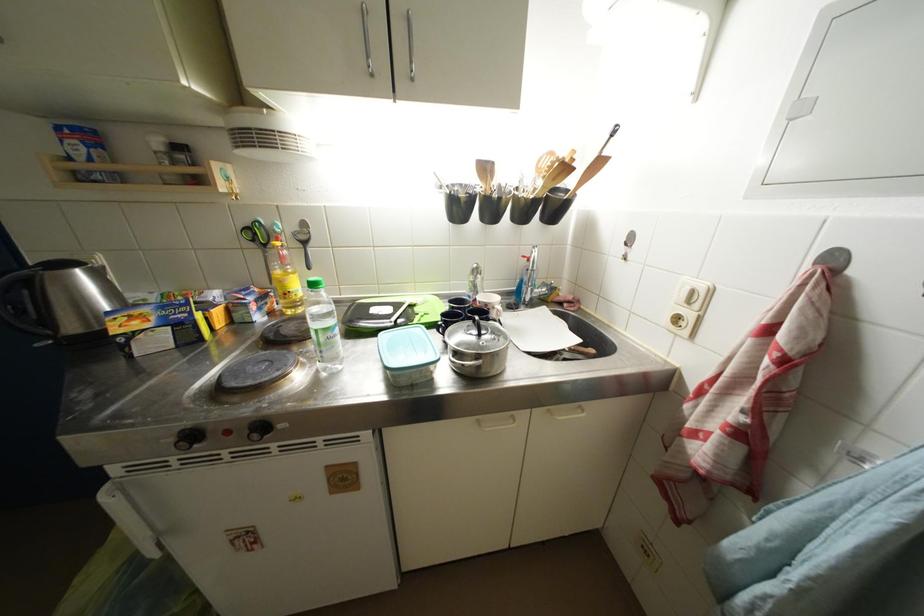
Which object does [285,278] point to?

This point indicates the yellow oil bottle.